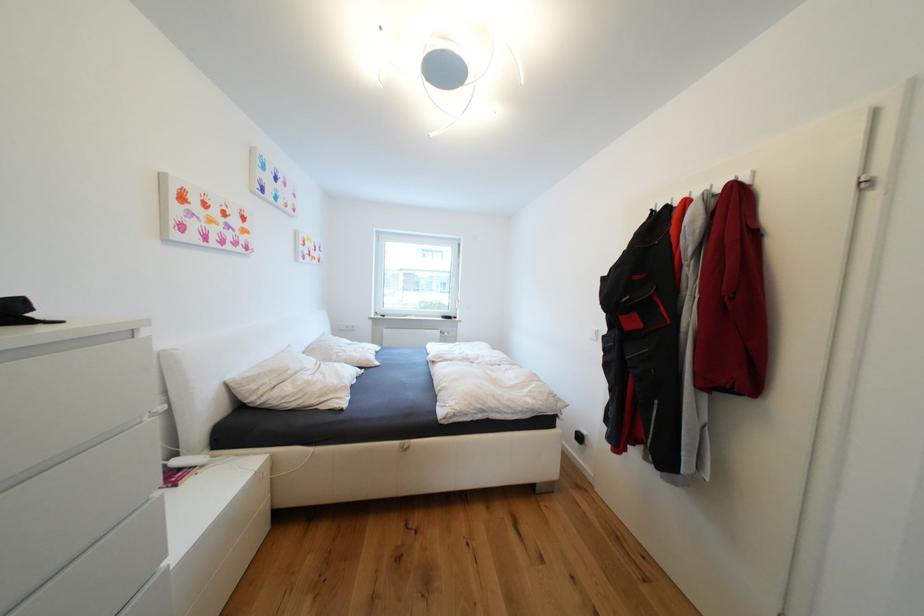
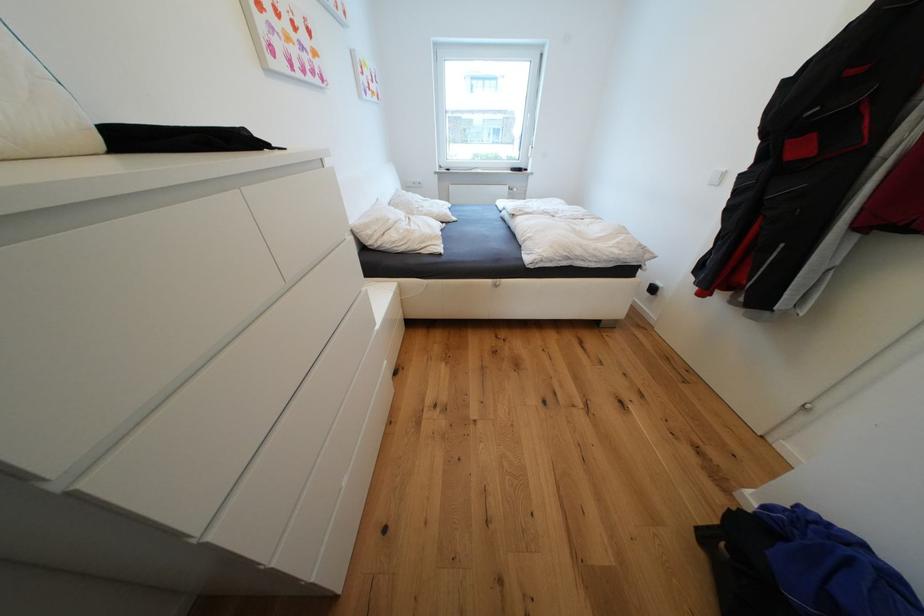
Where in the second image is the point corresponding to the point at 405,444 from the first image?

(496, 282)